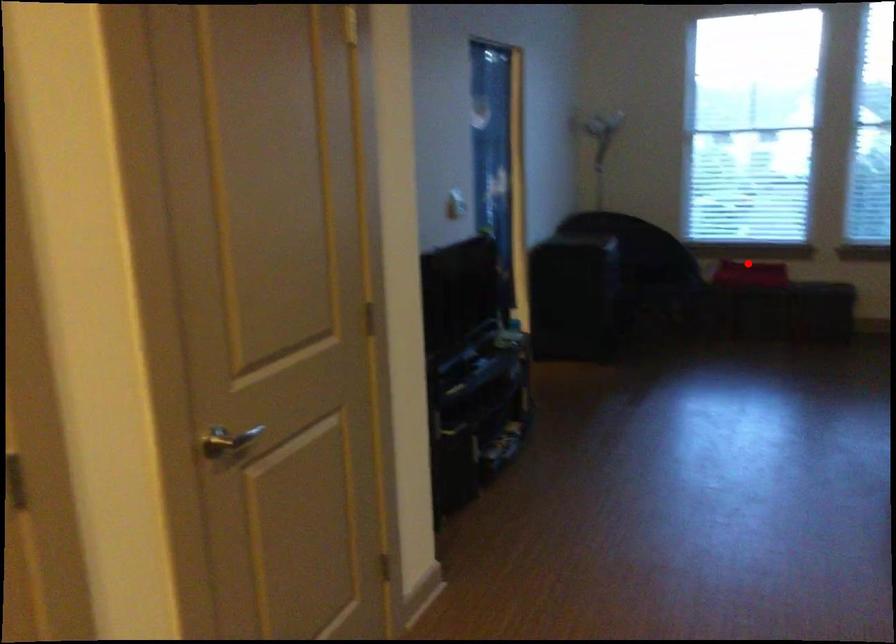
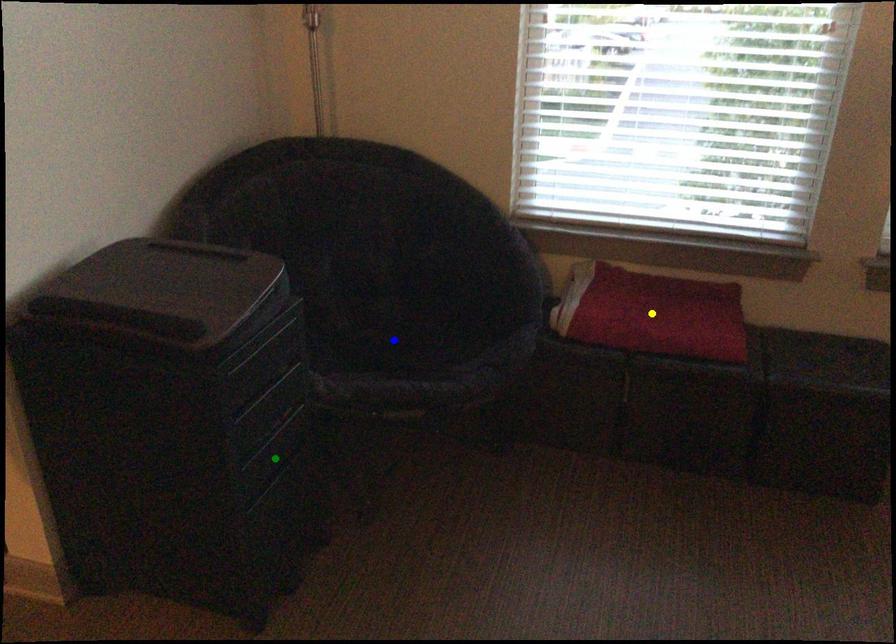
Question: I am providing you with two images of the same scene from different viewpoints. A red point is marked on the first image. You are given multiple points on the second image. Can you choose the point in image 2 that corresponds to the point in image 1?

Choices:
 (A) green point
 (B) yellow point
 (C) blue point

Answer: (B)